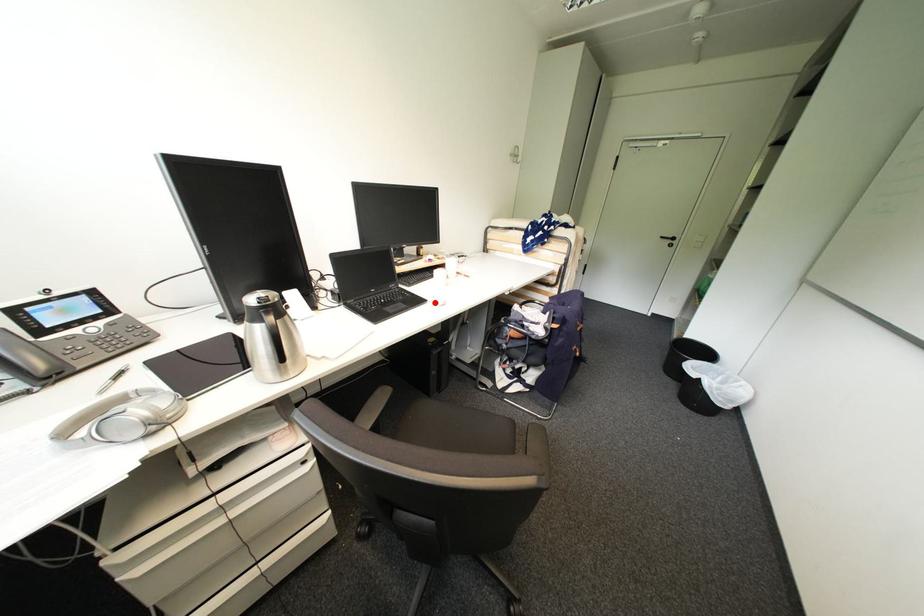
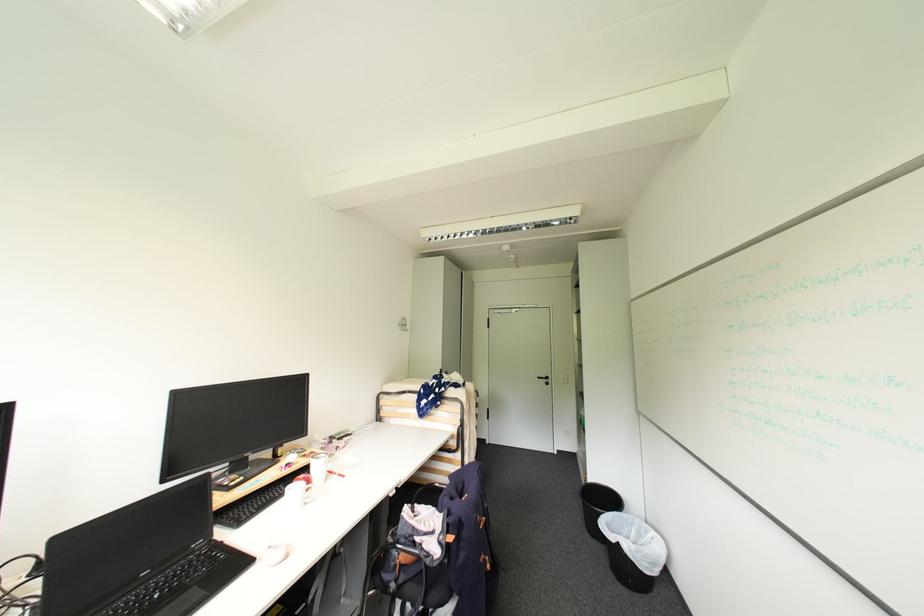
Locate, in the second image, the point that corresponds to the highlighted location in the first image.

(263, 562)